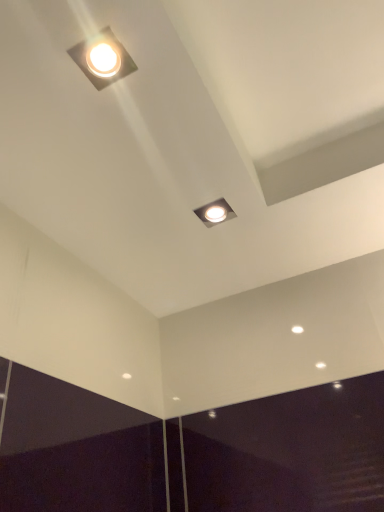
Question: Considering the positions of point (105, 39) and point (213, 223), is point (105, 39) closer or farther from the camera than point (213, 223)?

Choices:
 (A) closer
 (B) farther

Answer: (A)

Question: Is matte white square light at upper left, marked as the 1th lamp in a left-to-right arrangement, in front of or behind matte silver square at center, placed as the second lamp when sorted from left to right, in the image?

Choices:
 (A) behind
 (B) front

Answer: (B)

Question: Would you say matte white square light at upper left, marked as the 1th lamp in a left-to-right arrangement, is to the left or to the right of matte silver square at center, the second lamp positioned from the front, in the picture?

Choices:
 (A) left
 (B) right

Answer: (A)

Question: From a real-world perspective, is matte silver square at center, the 1th lamp from the bottom, physically located above or below matte white square light at upper left, which is the 2th lamp in bottom-to-top order?

Choices:
 (A) below
 (B) above

Answer: (A)

Question: Is matte silver square at center, placed as the second lamp when sorted from left to right, inside the boundaries of matte white square light at upper left, which is the second lamp from back to front, or outside?

Choices:
 (A) inside
 (B) outside

Answer: (B)

Question: Considering the positions of matte silver square at center, which is counted as the first lamp, starting from the back, and matte white square light at upper left, acting as the second lamp starting from the right, in the image, is matte silver square at center, which is counted as the first lamp, starting from the back, taller or shorter than matte white square light at upper left, acting as the second lamp starting from the right,?

Choices:
 (A) short
 (B) tall

Answer: (A)

Question: Considering the positions of matte silver square at center, which is the second lamp in top-to-bottom order, and matte white square light at upper left, acting as the second lamp starting from the right, in the image, is matte silver square at center, which is the second lamp in top-to-bottom order, wider or thinner than matte white square light at upper left, acting as the second lamp starting from the right,?

Choices:
 (A) wide
 (B) thin

Answer: (A)